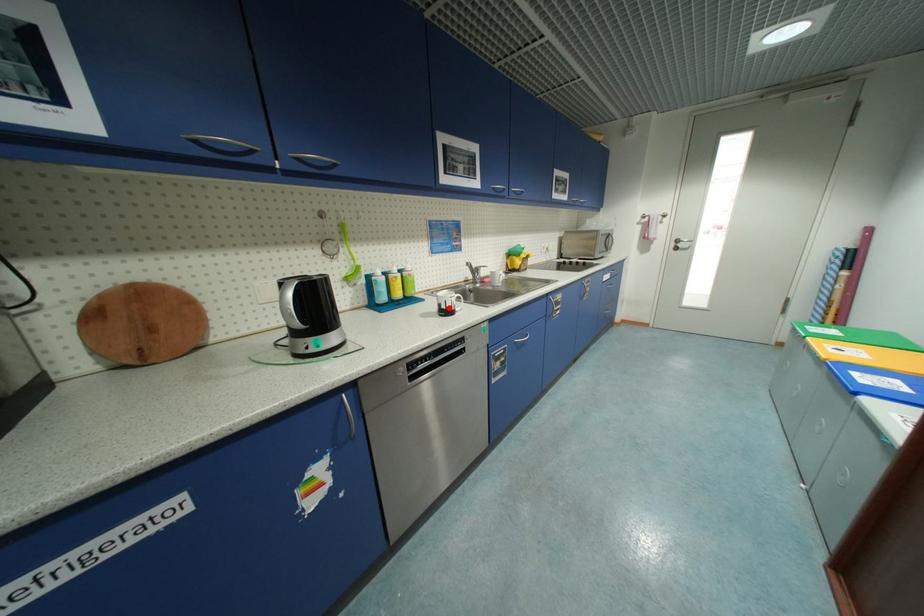
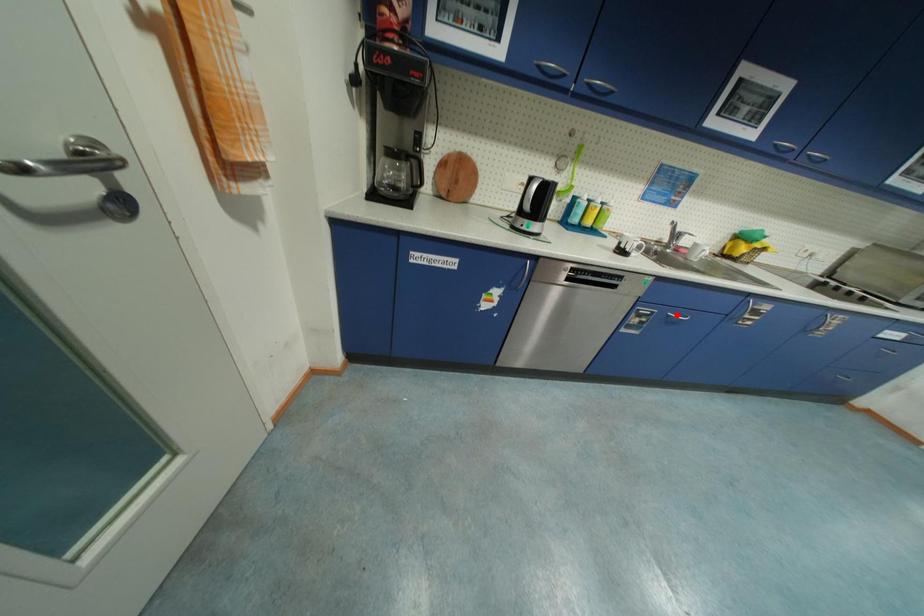
I am providing you with two images of the same scene from different viewpoints. A red point is marked on the first image and another point is marked on the second image. Is the red point in image1 aligned with the point shown in image2?

No